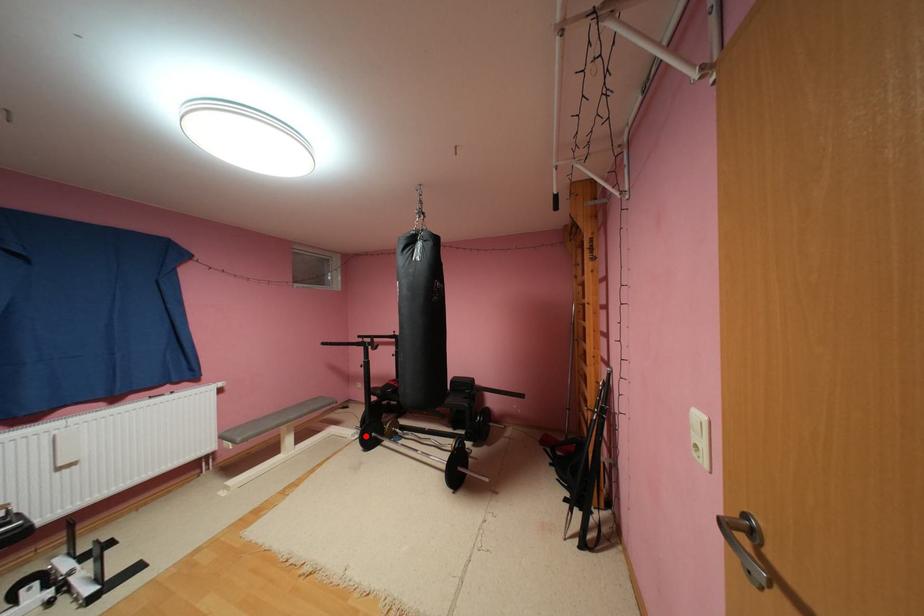
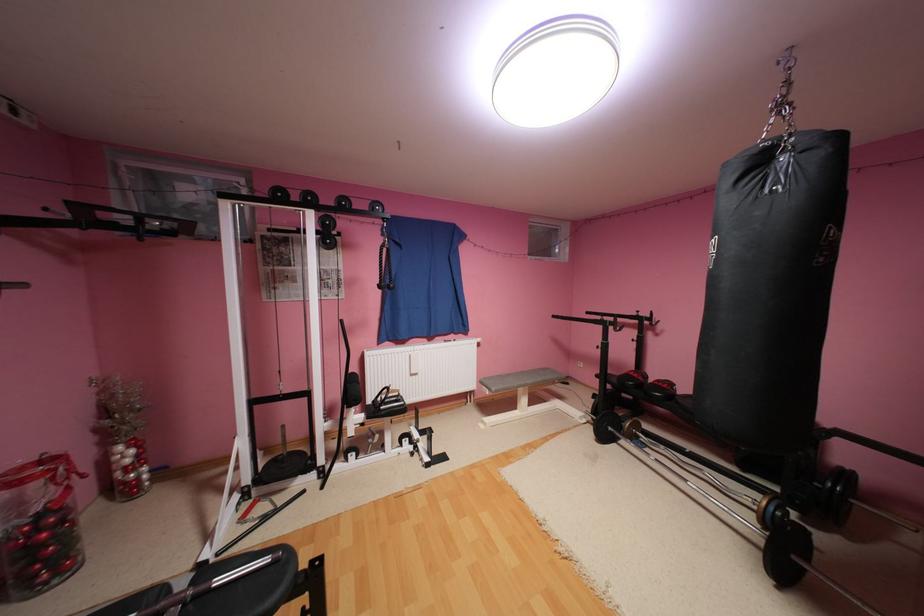
Question: I am providing you with two images of the same scene from different viewpoints. A red point is shown in image1. For the corresponding object point in image2, is it positioned nearer or farther from the camera?

Choices:
 (A) Nearer
 (B) Farther

Answer: (A)